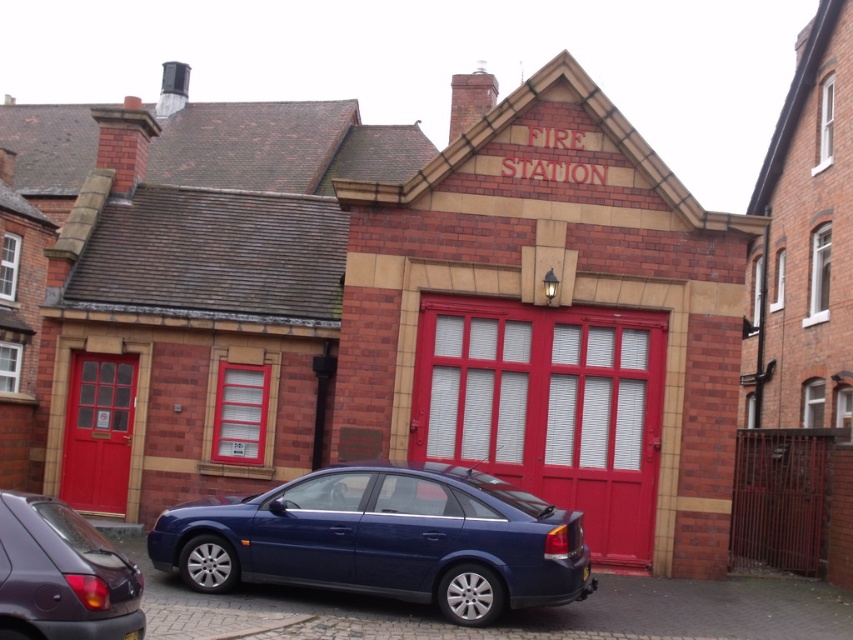
Question: Considering the relative positions of glossy blue sedan at center and matte purple car at lower left in the image provided, where is glossy blue sedan at center located with respect to matte purple car at lower left?

Choices:
 (A) left
 (B) right

Answer: (B)

Question: Which point is closer to the camera?

Choices:
 (A) click(x=80, y=593)
 (B) click(x=120, y=417)

Answer: (A)

Question: In this image, where is glossy blue sedan at center located relative to matte purple car at lower left?

Choices:
 (A) right
 (B) left

Answer: (A)

Question: Which point is closer to the camera taking this photo?

Choices:
 (A) (316, 525)
 (B) (457, 372)
 (C) (45, 536)

Answer: (C)

Question: Which point is farther to the camera?

Choices:
 (A) (569, 368)
 (B) (96, 452)
 (C) (450, 579)
 (D) (62, 600)

Answer: (B)

Question: Does smooth glossy red garage door at center lie in front of matte purple car at lower left?

Choices:
 (A) yes
 (B) no

Answer: (B)